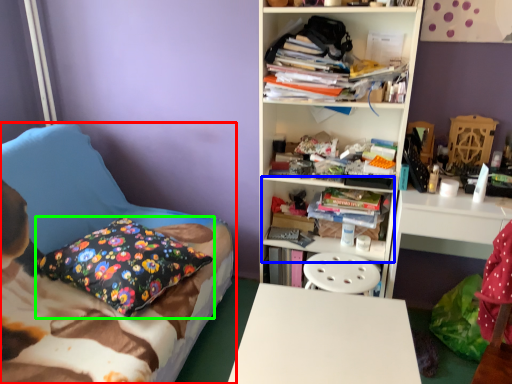
Question: Which is farther away from bed (highlighted by a red box)? cabinet (highlighted by a blue box) or pillow (highlighted by a green box)?

Choices:
 (A) cabinet
 (B) pillow

Answer: (A)